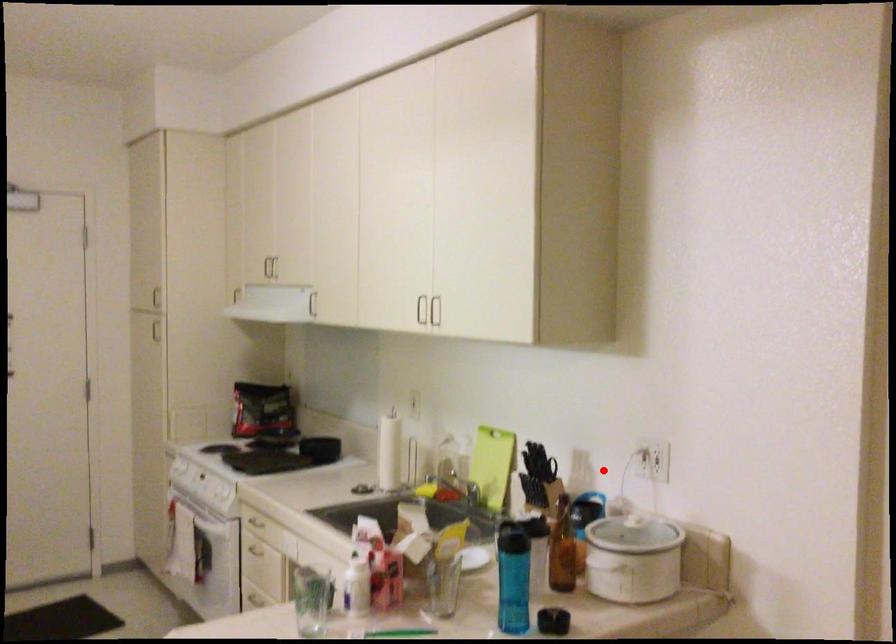
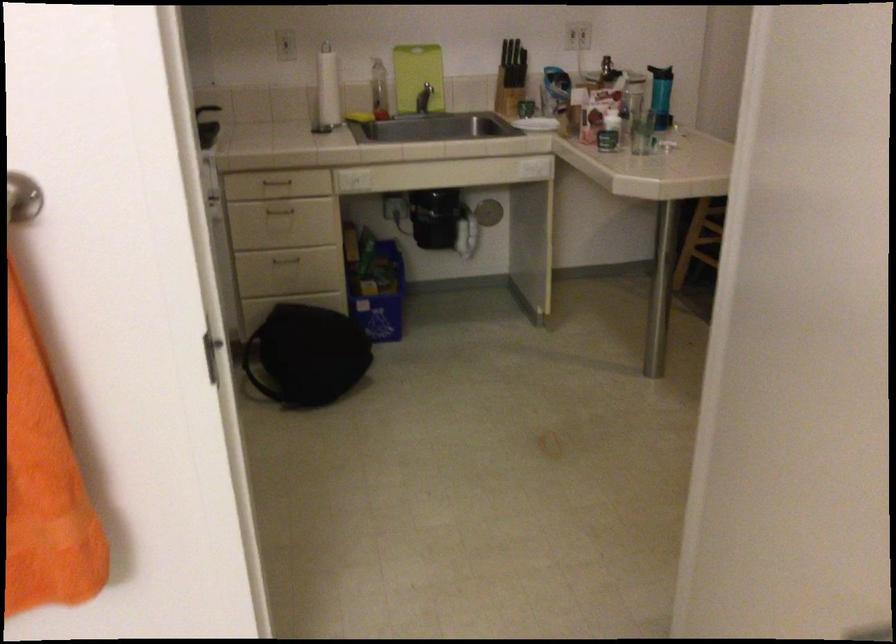
The point at the highlighted location is marked in the first image. Where is the corresponding point in the second image?

(518, 53)